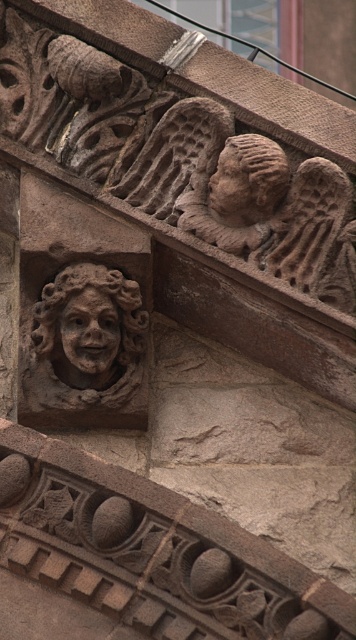
You are an architect examining the stone carvings in the image. You notice two points marked on the structure. The first point is at coordinates point (133, 320) and the second is at point (241, 212). From your perspective, which point is closer to you?

Point (241, 212) is closer to you because the description states that point (133, 320) is behind point (241, 212).

Based on the photo, you are an art conservator examining the architectural detail. You notice two carved faces in the stone work. The brown stone face at center and the matte stone face at upper center. Which face is located higher up in the structure?

The matte stone face at upper center is located higher up in the structure than the brown stone face at center.

You are an architect examining the stone carvings. You notice the brown stone head at upper center and the matte stone face at center. Which of these two carvings is positioned higher up in the structure?

The brown stone head at upper center is positioned higher up in the structure as it is located above the matte stone face at center.